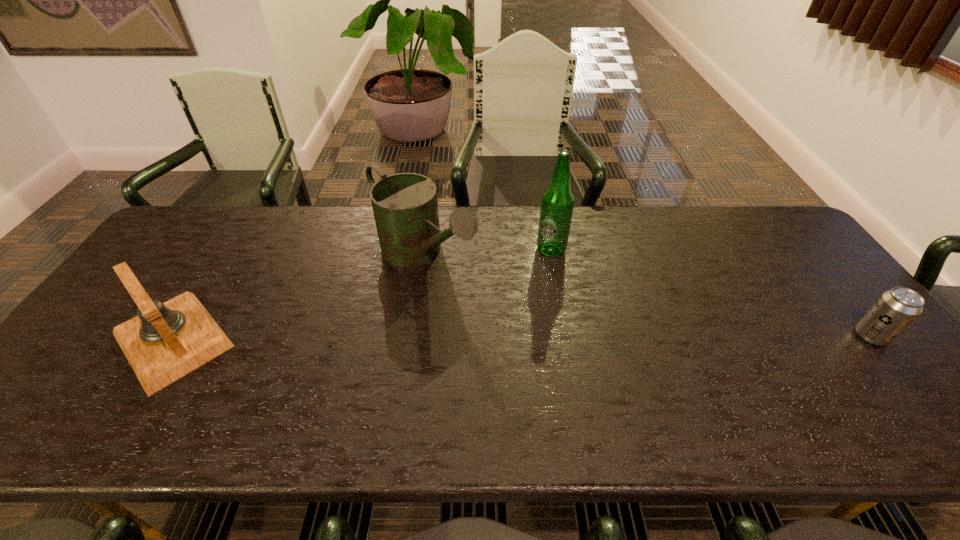
This screenshot has height=540, width=960. What are the coordinates of `vacant space on the desktop that is between the third tallest object and the shortest object and is positioned on the label of the second object from right to left` in the screenshot? It's located at [x=572, y=338].

Where is `free spot on the desktop that is between the bell and the rightmost object and is positioned with the spout on the watering can`? free spot on the desktop that is between the bell and the rightmost object and is positioned with the spout on the watering can is located at coordinates (529, 338).